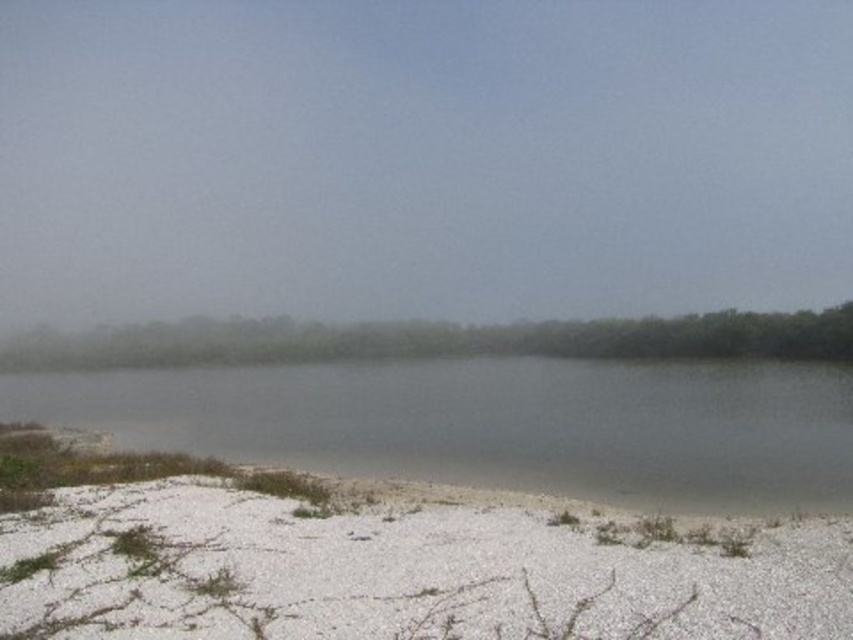
Describe the element at coordinates (421, 157) in the screenshot. The image size is (853, 640). I see `foggy haze at upper center` at that location.

Between foggy haze at upper center and gray matte lake at center, which one is positioned higher?

Positioned higher is foggy haze at upper center.

Is point (723, 13) in front of point (706, 412)?

No, (723, 13) is behind (706, 412).

In order to click on foggy haze at upper center in this screenshot , I will do point(421,157).

Does white gravelly sand at lower left have a lesser width compared to gray matte lake at center?

Yes.

Measure the distance between point (78, 528) and camera.

They are 13.03 meters apart.

Who is more distant from viewer, (201, 637) or (604, 420)?

The point (604, 420) is behind.

At what (x,y) coordinates should I click in order to perform the action: click on white gravelly sand at lower left. Please return your answer as a coordinate pair (x, y). The width and height of the screenshot is (853, 640). Looking at the image, I should click on (395, 573).

Can you confirm if foggy haze at upper center is positioned above white gravelly sand at lower left?

Yes, foggy haze at upper center is above white gravelly sand at lower left.

Between point (450, 211) and point (368, 513), which one is positioned behind?

The point (450, 211) is behind.

Which is in front, point (402, 250) or point (83, 518)?

Point (83, 518)

Identify the location of foggy haze at upper center. This screenshot has width=853, height=640. (421, 157).